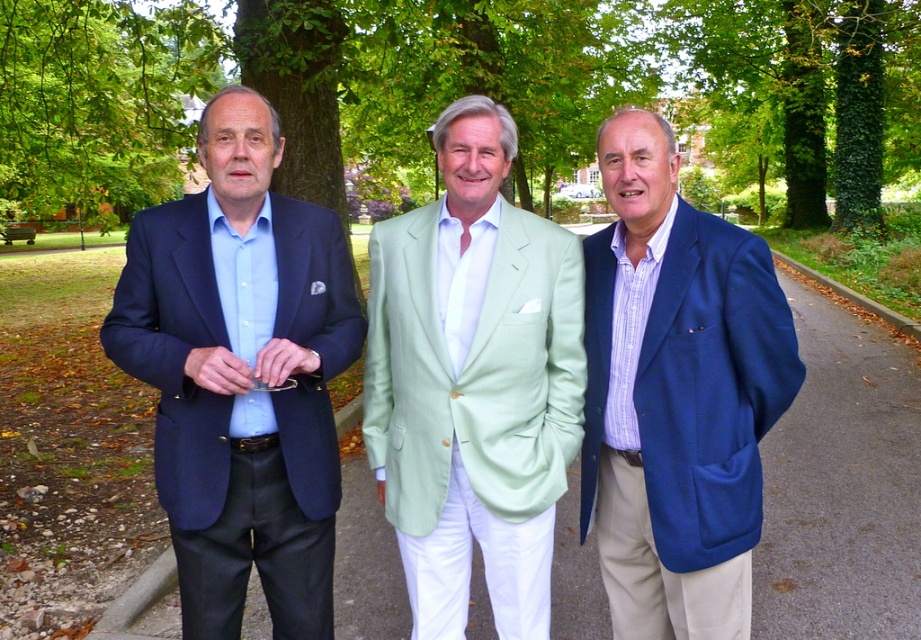
Question: Which point is farther from the camera taking this photo?

Choices:
 (A) (211, 541)
 (B) (706, 452)
 (C) (118, 81)

Answer: (C)

Question: Is matte blue suit at left positioned before green leafy tree at upper center?

Choices:
 (A) yes
 (B) no

Answer: (A)

Question: Can you confirm if green leafy tree at center is positioned to the left of blue woolen blazer at center?

Choices:
 (A) yes
 (B) no

Answer: (A)

Question: Among these objects, which one is farthest from the camera?

Choices:
 (A) matte blue suit at left
 (B) light green cotton blazer at center

Answer: (B)

Question: Which point is closer to the camera?

Choices:
 (A) green leafy tree at center
 (B) green leafy tree at upper center
 (C) light green cotton blazer at center
 (D) green leafy tree at left

Answer: (C)

Question: Is matte blue suit at left smaller than green leafy tree at upper center?

Choices:
 (A) no
 (B) yes

Answer: (B)